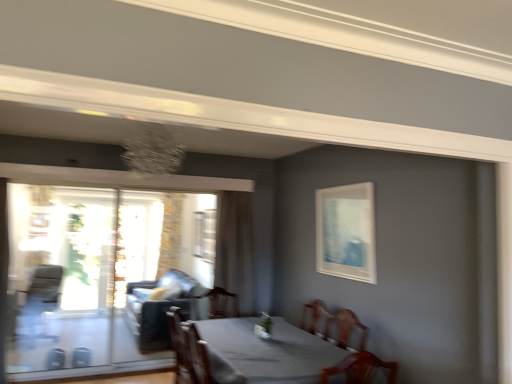
Question: Would you say clear glass window at center, placed as the second window when sorted from left to right, is outside suede-like dark gray couch at left?

Choices:
 (A) no
 (B) yes

Answer: (B)

Question: Is clear glass window at center, marked as the 1th window in a back-to-front arrangement, aimed at suede-like dark gray couch at left?

Choices:
 (A) no
 (B) yes

Answer: (A)

Question: From the image's perspective, is clear glass window at center, marked as the 1th window in a back-to-front arrangement, on suede-like dark gray couch at left?

Choices:
 (A) yes
 (B) no

Answer: (A)

Question: Is the depth of clear glass window at center, which is the second window in front-to-back order, greater than that of suede-like dark gray couch at left?

Choices:
 (A) yes
 (B) no

Answer: (A)

Question: From a real-world perspective, does clear glass window at center, which is the second window in front-to-back order, sit lower than suede-like dark gray couch at left?

Choices:
 (A) yes
 (B) no

Answer: (B)

Question: Looking at their shapes, would you say transparent glass screen door at left is wider or thinner than clear glass window at center, marked as the 1th window in a back-to-front arrangement?

Choices:
 (A) thin
 (B) wide

Answer: (B)

Question: Does point (22, 273) appear closer or farther from the camera than point (203, 210)?

Choices:
 (A) closer
 (B) farther

Answer: (A)

Question: From the image's perspective, is transparent glass screen door at left above or below clear glass window at center, marked as the 1th window in a back-to-front arrangement?

Choices:
 (A) above
 (B) below

Answer: (B)

Question: Is transparent glass screen door at left bigger or smaller than clear glass window at center, placed as the second window when sorted from left to right?

Choices:
 (A) small
 (B) big

Answer: (B)

Question: Do you think transparent glass window at left, the 2th window positioned from the right, is within clear glass window at center, marked as the 1th window in a back-to-front arrangement, or outside of it?

Choices:
 (A) inside
 (B) outside

Answer: (B)

Question: From their relative heights in the image, would you say transparent glass window at left, positioned as the first window in front-to-back order, is taller or shorter than clear glass window at center, the 1th window viewed from the right?

Choices:
 (A) short
 (B) tall

Answer: (B)

Question: Is transparent glass window at left, positioned as the first window in front-to-back order, to the left or to the right of clear glass window at center, marked as the 1th window in a back-to-front arrangement, in the image?

Choices:
 (A) right
 (B) left

Answer: (B)

Question: Is point (131, 311) positioned closer to the camera than point (210, 233)?

Choices:
 (A) closer
 (B) farther

Answer: (B)

Question: Looking at their shapes, would you say brown sheer curtain at center, the 1th curtain in the right-to-left sequence, is wider or thinner than transparent glass screen door at left?

Choices:
 (A) wide
 (B) thin

Answer: (A)

Question: Visually, is brown sheer curtain at center, the first curtain viewed from the front, positioned to the left or to the right of transparent glass screen door at left?

Choices:
 (A) right
 (B) left

Answer: (A)